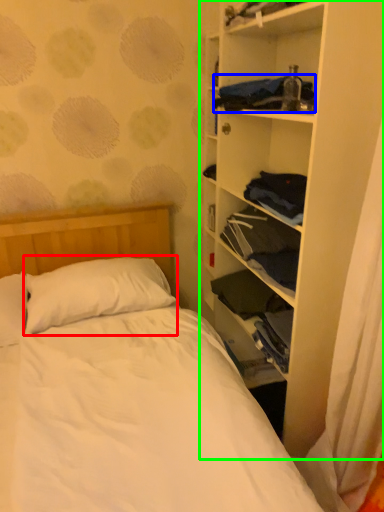
Question: Which is nearer to the pillow (highlighted by a red box)? clothing (highlighted by a blue box) or shelf (highlighted by a green box).

Choices:
 (A) clothing
 (B) shelf

Answer: (B)